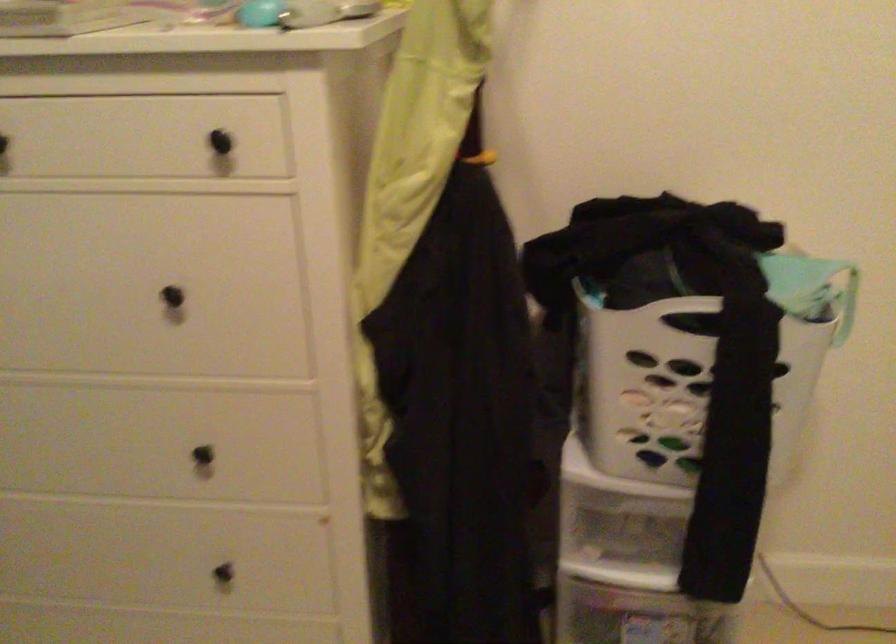
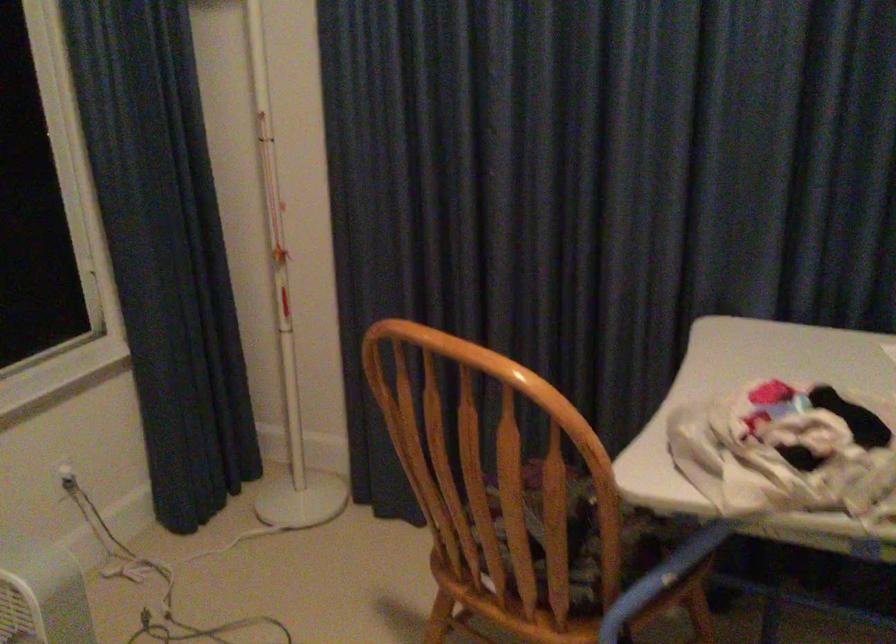
Based on the photo, the first image is from the beginning of the video and the second image is from the end. How did the camera likely rotate when shooting the video?

The camera's rotation is toward left-down.